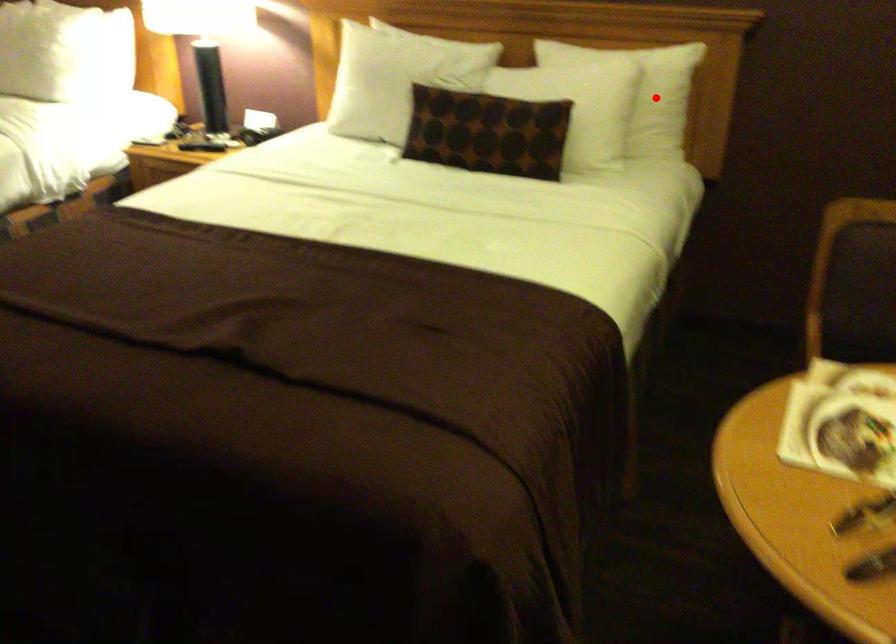
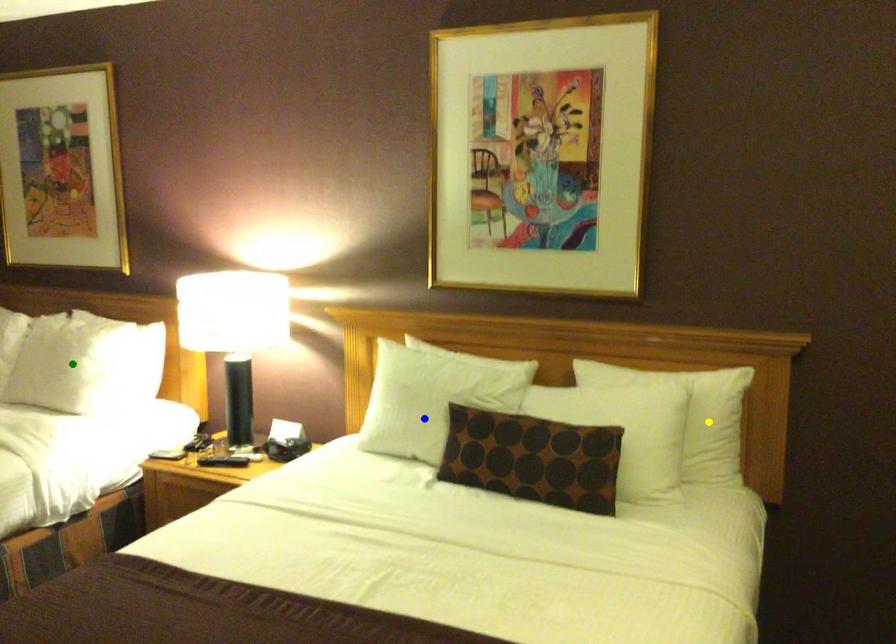
Question: I am providing you with two images of the same scene from different viewpoints. A red point is marked on the first image. You are given multiple points on the second image. Which spot in image 2 lines up with the point in image 1?

Choices:
 (A) green point
 (B) yellow point
 (C) blue point

Answer: (B)